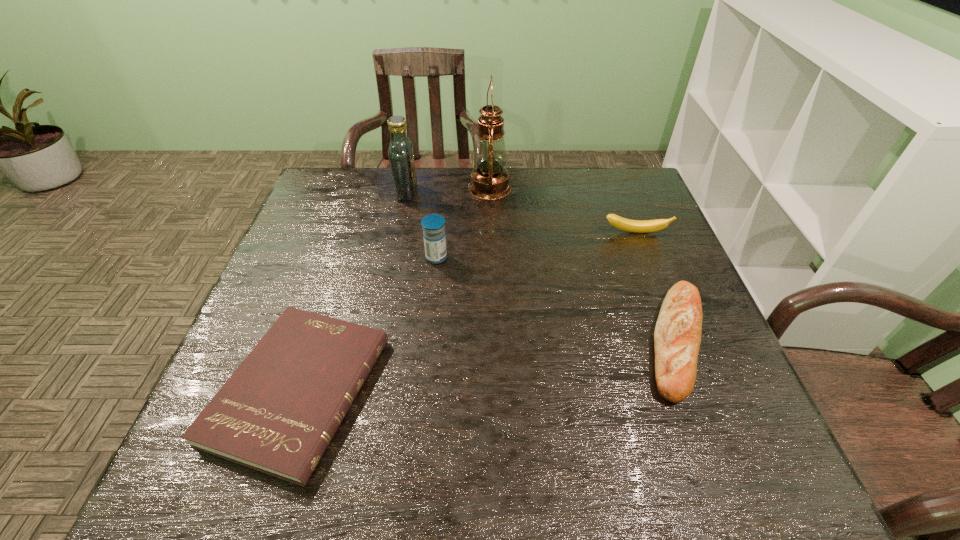
Where is `free spot between the shortest object and the fourth object from left to right`? The image size is (960, 540). free spot between the shortest object and the fourth object from left to right is located at coordinates (395, 289).

The height and width of the screenshot is (540, 960). I want to click on vacant space in between the vodka and the fourth nearest object, so (521, 212).

Locate an element on the screen. The width and height of the screenshot is (960, 540). empty location between the fourth shortest object and the shortest object is located at coordinates (368, 324).

Image resolution: width=960 pixels, height=540 pixels. I want to click on vacant space that's between the second tallest object and the baguet, so tap(541, 267).

Select which object is the closest to the baguet. Please provide its 2D coordinates. Your answer should be formatted as a tuple, i.e. [(x, y)], where the tuple contains the x and y coordinates of a point satisfying the conditions above.

[(638, 226)]

The height and width of the screenshot is (540, 960). Find the location of `object that ranks as the second closest to the third nearest object`. object that ranks as the second closest to the third nearest object is located at coordinates (489, 179).

The height and width of the screenshot is (540, 960). I want to click on vacant space that satisfies the following two spatial constraints: 1. on the back side of the hardback book; 2. on the right side of the fourth object from left to right, so click(x=365, y=187).

Locate an element on the screen. This screenshot has width=960, height=540. vacant space that satisfies the following two spatial constraints: 1. on the front-facing side of the second tallest object; 2. on the right side of the third nearest object is located at coordinates (393, 258).